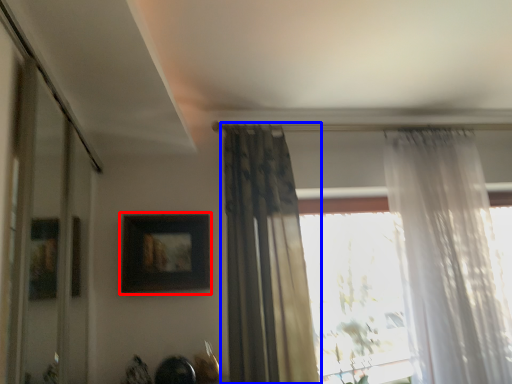
Question: Which of the following is the closest to the observer, picture frame (highlighted by a red box) or curtain (highlighted by a blue box)?

Choices:
 (A) picture frame
 (B) curtain

Answer: (B)